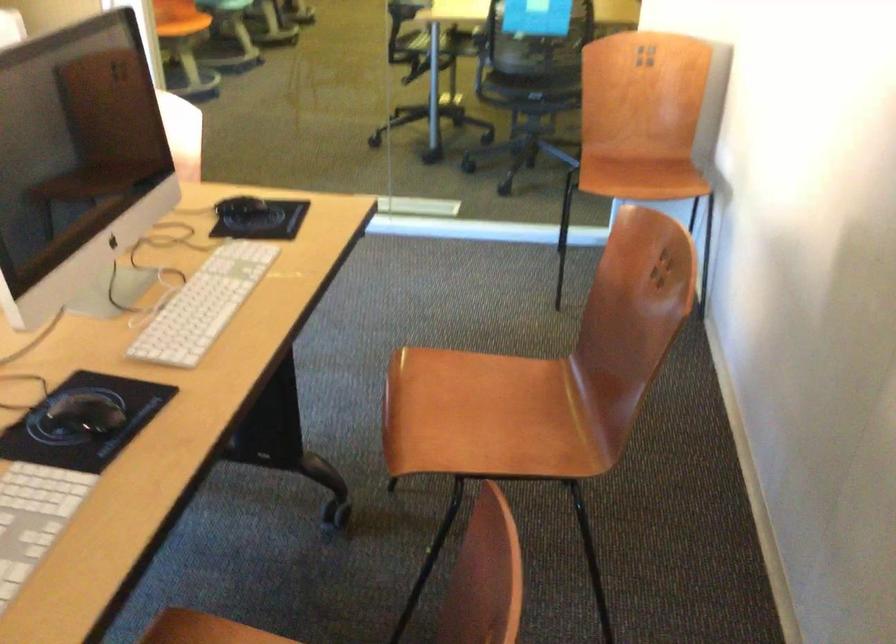
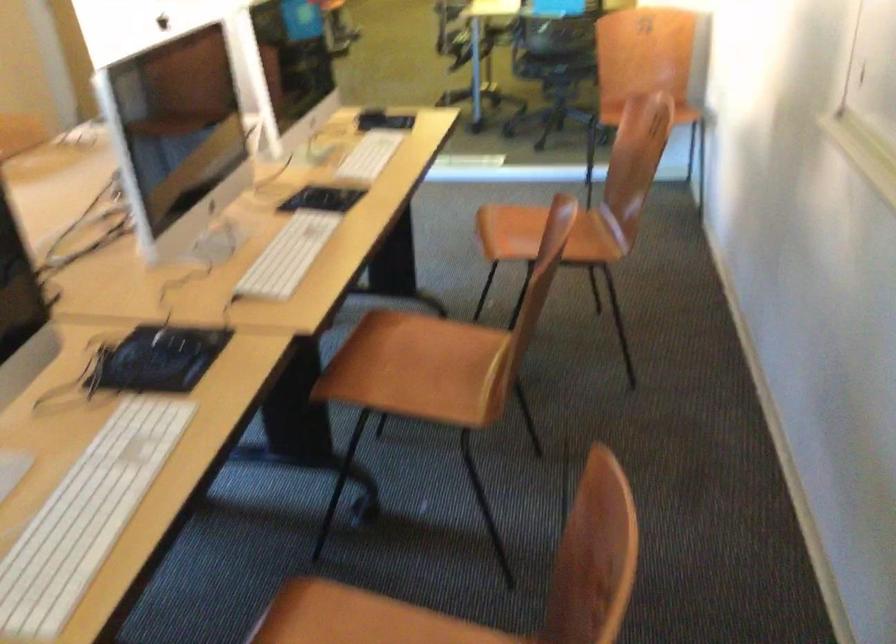
Question: The camera is either moving clockwise (left) or counter-clockwise (right) around the object. The first image is from the beginning of the video and the second image is from the end. Is the camera moving left or right when shooting the video?

Choices:
 (A) Left
 (B) Right

Answer: (B)